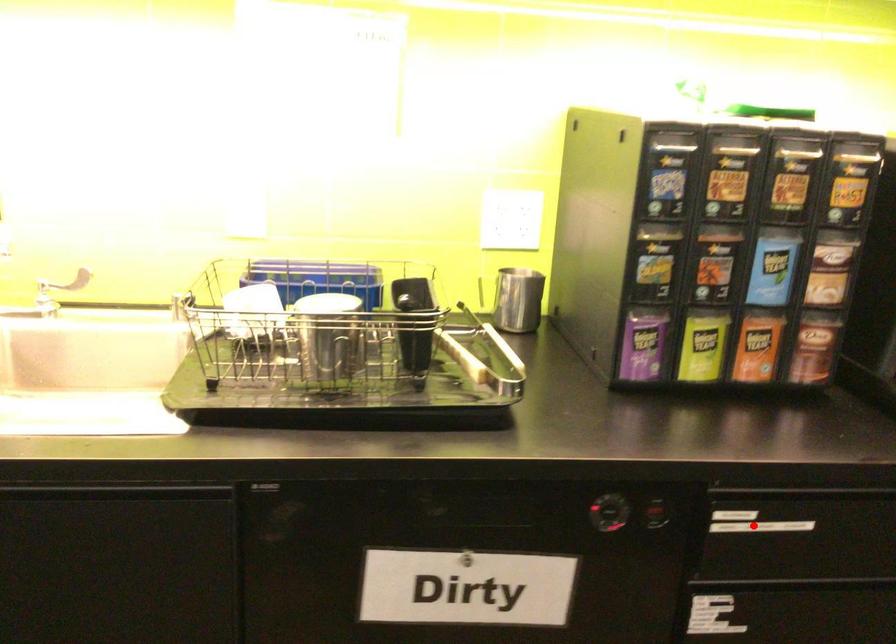
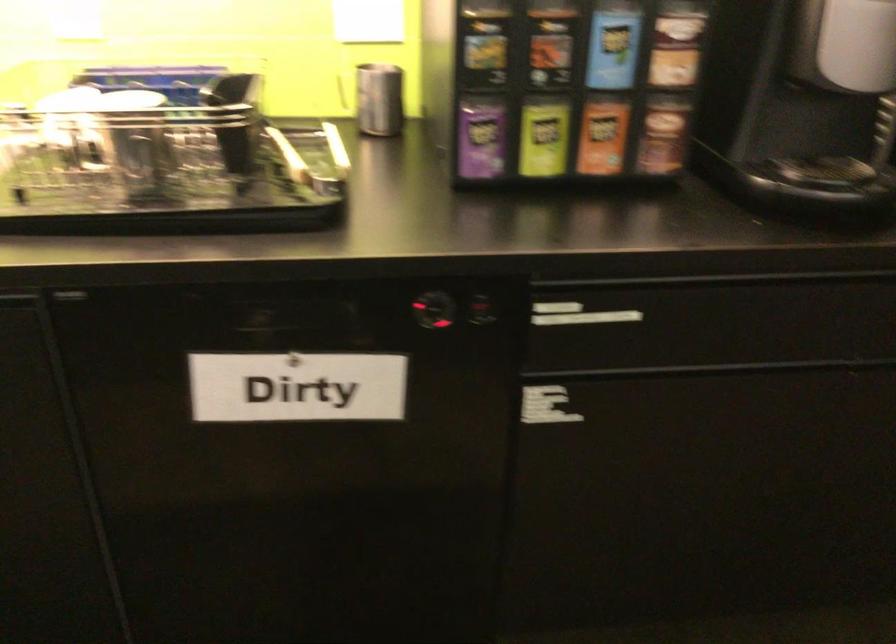
Where in the second image is the point corresponding to the highlighted location from the first image?

(578, 315)